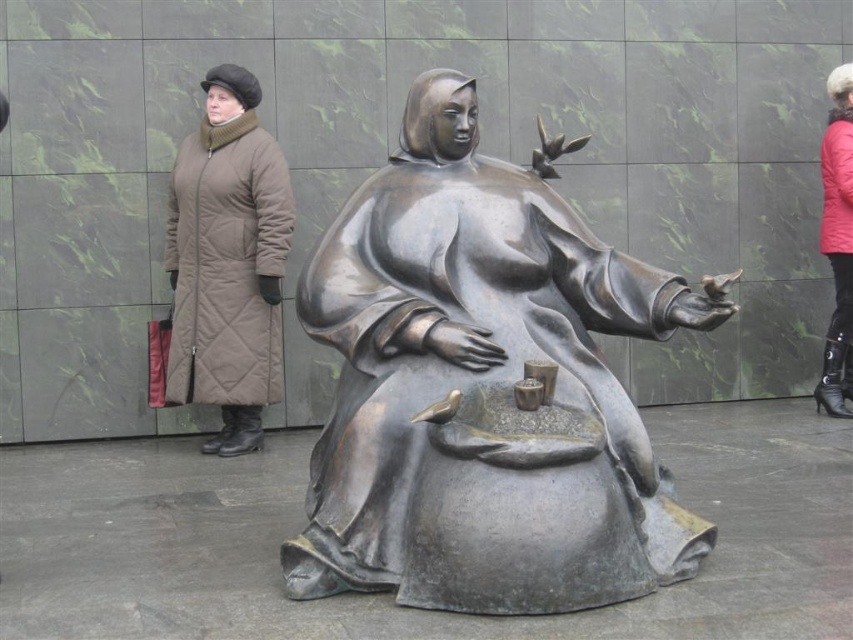
Question: In this image, where is bronze statue at center located relative to matte brown coat at left?

Choices:
 (A) below
 (B) above

Answer: (A)

Question: Does bronze statue at center have a lesser width compared to red quilted coat at right?

Choices:
 (A) no
 (B) yes

Answer: (A)

Question: Which of the following is the farthest from the observer?

Choices:
 (A) bronze statue at center
 (B) red quilted coat at right

Answer: (B)

Question: Which of the following is the farthest from the observer?

Choices:
 (A) red quilted coat at right
 (B) bronze statue at center
 (C) matte brown coat at left

Answer: (A)

Question: Estimate the real-world distances between objects in this image. Which object is closer to the matte brown coat at left?

Choices:
 (A) red quilted coat at right
 (B) bronze statue at center

Answer: (B)

Question: Is matte brown coat at left bigger than red quilted coat at right?

Choices:
 (A) no
 (B) yes

Answer: (B)